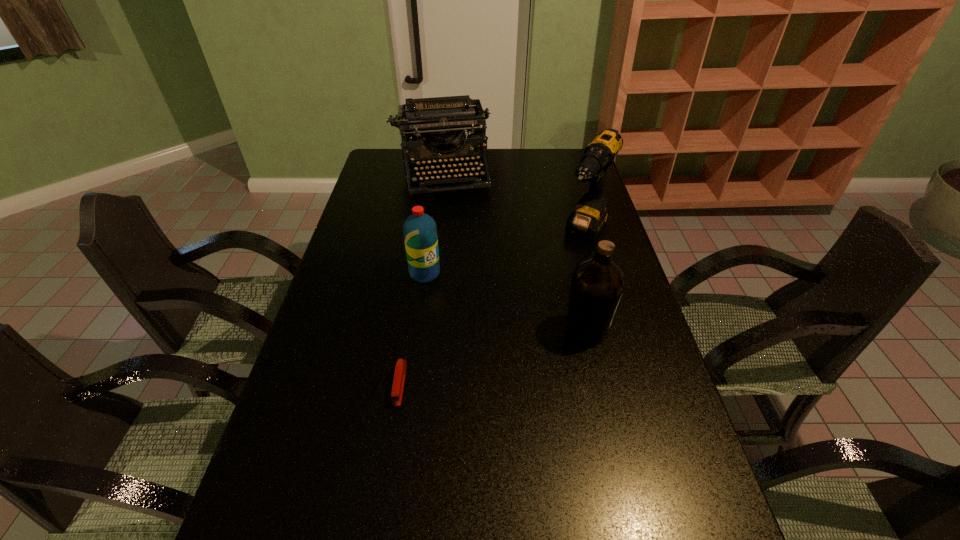
Locate an element on the screen. free space located 0.310m on the front label of the third nearest object is located at coordinates (477, 357).

You are a GUI agent. You are given a task and a screenshot of the screen. Output one action in this format:
    pyautogui.click(x=<x>, y=<y>)
    Task: Click on the vacant space located 0.170m at the tip of the second farthest object
    The image size is (960, 540).
    Given the screenshot: What is the action you would take?
    pyautogui.click(x=560, y=288)

Locate an element on the screen. free space located 0.380m at the tip of the second farthest object is located at coordinates (532, 336).

What are the coordinates of `free space located 0.250m at the tip of the second farthest object` in the screenshot? It's located at (550, 305).

The image size is (960, 540). What are the coordinates of `free location located 0.160m on the typing side of the typewriter` in the screenshot? It's located at (452, 226).

Locate an element on the screen. vacant area situated on the typing side of the typewriter is located at coordinates click(x=452, y=226).

The image size is (960, 540). I want to click on vacant region located 0.360m on the typing side of the typewriter, so click(x=460, y=263).

Locate an element on the screen. object present at the far edge is located at coordinates (429, 121).

Where is `object present at the left edge`? object present at the left edge is located at coordinates (429, 121).

Identify the location of olive oil present at the right edge. This screenshot has height=540, width=960. (597, 284).